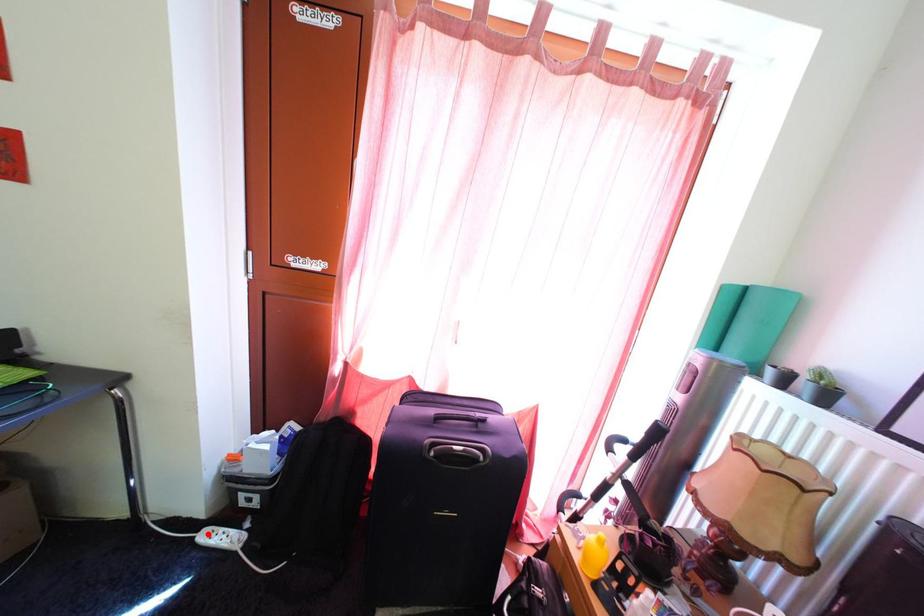
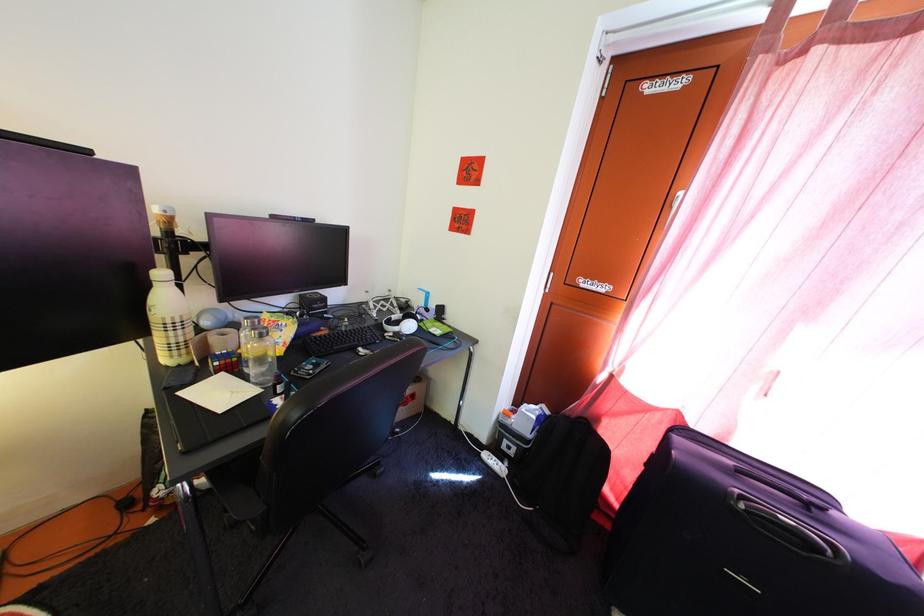
Locate, in the second image, the point that corresponds to the highlighted location in the first image.

(492, 456)